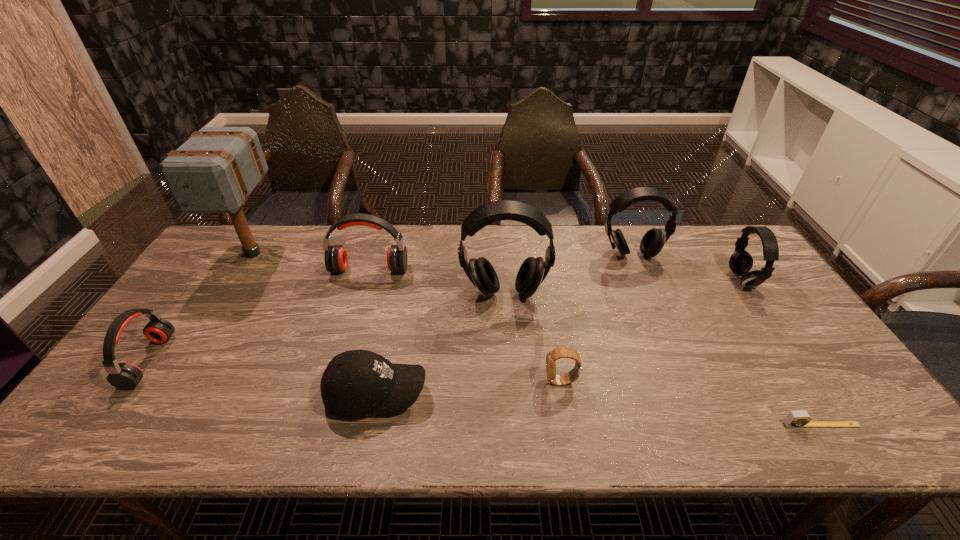
The image size is (960, 540). Find the location of `mallet that is at the left edge`. mallet that is at the left edge is located at coordinates (215, 171).

At what (x,y) coordinates should I click in order to perform the action: click on earphone that is at the left edge. Please return your answer as a coordinate pair (x, y). This screenshot has height=540, width=960. Looking at the image, I should click on (126, 376).

Locate an element on the screen. earphone at the right edge is located at coordinates (740, 262).

What are the coordinates of `tape measure positioned at the right edge` in the screenshot? It's located at (795, 419).

Where is `object that is at the far left corner`? object that is at the far left corner is located at coordinates (215, 171).

This screenshot has width=960, height=540. Identify the location of object that is positioned at the far right corner. (740, 262).

Locate an element on the screen. The height and width of the screenshot is (540, 960). object that is at the near right corner is located at coordinates (795, 419).

The image size is (960, 540). In order to click on free location at the far edge of the desktop in this screenshot , I will do `click(669, 240)`.

I want to click on free location at the near edge of the desktop, so click(634, 416).

In the image, there is a desktop. Identify the location of vacant space at the left edge. This screenshot has width=960, height=540. (173, 364).